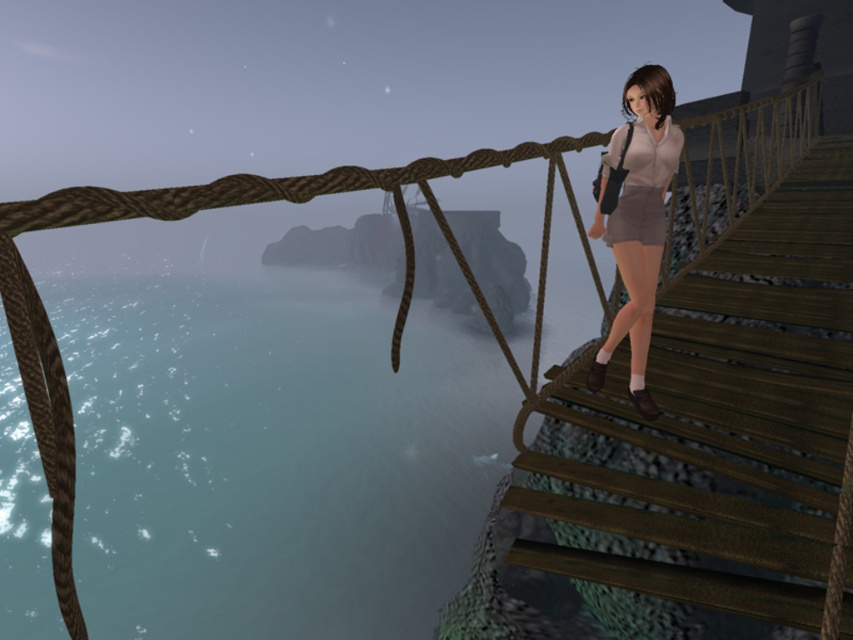
Question: Which object is positioned farthest from the matte gray shorts at center?

Choices:
 (A) translucent blue water at lower left
 (B) wooden stairs at right

Answer: (A)

Question: Does translucent blue water at lower left lie in front of wooden stairs at right?

Choices:
 (A) no
 (B) yes

Answer: (A)

Question: Among these objects, which one is nearest to the camera?

Choices:
 (A) wooden stairs at right
 (B) matte gray shorts at center

Answer: (A)

Question: Can you confirm if translucent blue water at lower left is positioned to the right of matte gray shorts at center?

Choices:
 (A) yes
 (B) no

Answer: (B)

Question: Which is nearer to the translucent blue water at lower left?

Choices:
 (A) matte gray shorts at center
 (B) wooden stairs at right

Answer: (B)

Question: Can you confirm if translucent blue water at lower left is positioned below matte gray shorts at center?

Choices:
 (A) no
 (B) yes

Answer: (B)